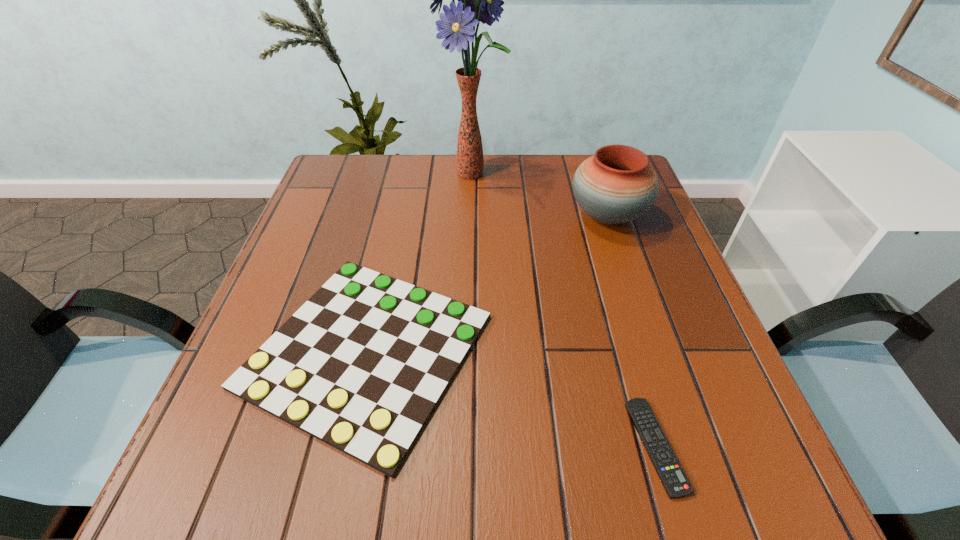
The height and width of the screenshot is (540, 960). I want to click on free region at the left edge, so click(211, 410).

Find the location of `free region at the right edge of the desktop`. free region at the right edge of the desktop is located at coordinates (622, 287).

Find the location of a particular element. free spot at the far left corner of the desktop is located at coordinates (374, 163).

Find the location of a particular element. vacant space in between the remote control and the tallest object is located at coordinates (564, 310).

Locate an element on the screen. This screenshot has width=960, height=540. vacant point located between the second tallest object and the checkerboard is located at coordinates (487, 283).

Find the location of a particular element. vacant area that lies between the remote control and the tallest object is located at coordinates (564, 310).

At what (x,y) coordinates should I click in order to perform the action: click on empty space that is in between the checkerboard and the third shortest object. Please return your answer as a coordinate pair (x, y). The image size is (960, 540). Looking at the image, I should click on (487, 283).

Find the location of a particular element. This screenshot has height=540, width=960. empty space between the flower arrangement and the remote control is located at coordinates (564, 310).

Identify the location of free spot between the pottery and the flower arrangement. (540, 195).

This screenshot has width=960, height=540. Identify the location of blank region between the checkerboard and the flower arrangement. (420, 262).